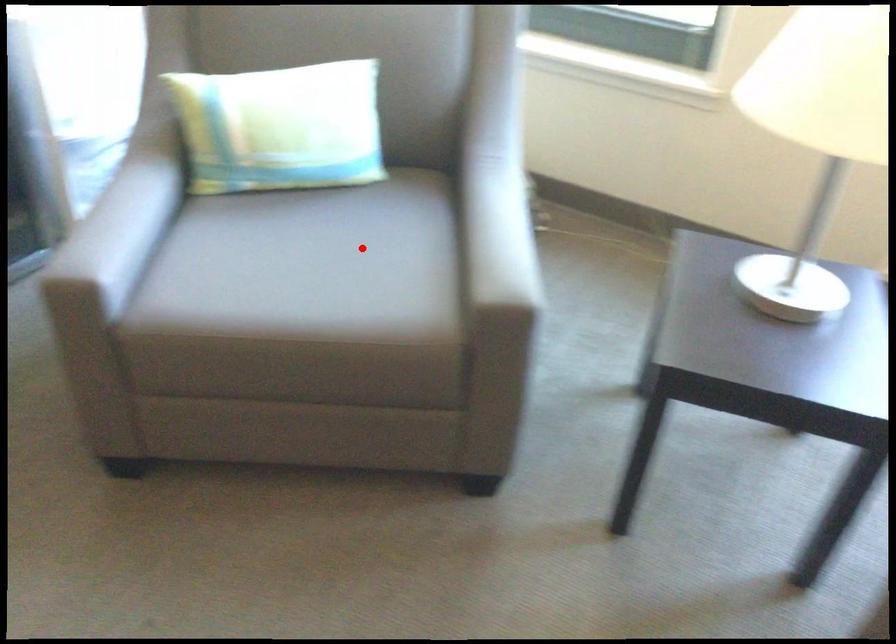
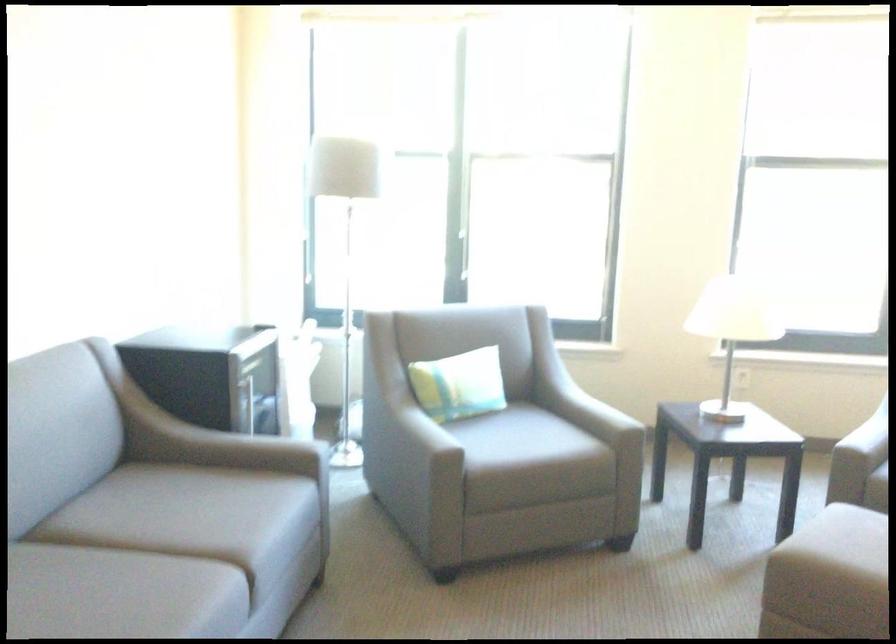
In the second image, find the point that corresponds to the highlighted location in the first image.

(495, 431)